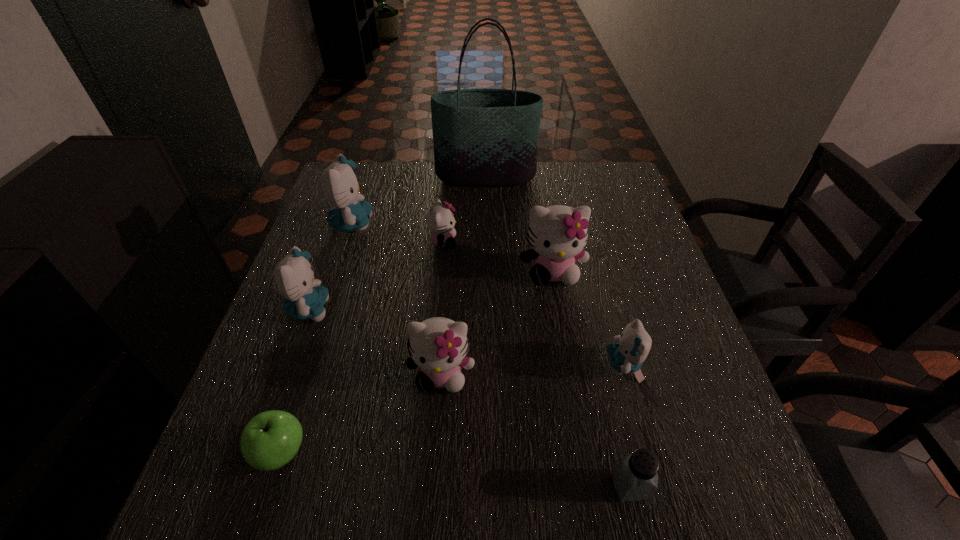
Locate an element on the screen. vacant space situated 0.290m on the face of the nearest blue kitten is located at coordinates (464, 364).

Find the location of a particular element. This screenshot has height=540, width=960. vacant space located 0.120m on the back of the apple is located at coordinates (308, 370).

The width and height of the screenshot is (960, 540). In order to click on vacant space located 0.340m on the back of the saltshaker in this screenshot , I will do `click(591, 316)`.

Where is `object at the far edge`? This screenshot has width=960, height=540. object at the far edge is located at coordinates (483, 137).

You are a GUI agent. You are given a task and a screenshot of the screen. Output one action in this format:
    pyautogui.click(x=<x>, y=<y>)
    Task: Click on the apple located at the near edge
    The height and width of the screenshot is (540, 960).
    Given the screenshot: What is the action you would take?
    pyautogui.click(x=271, y=439)

Find the location of a particular element. Image resolution: width=960 pixels, height=540 pixels. saltshaker located at the near edge is located at coordinates (635, 477).

Where is `apple located at the left edge`? The width and height of the screenshot is (960, 540). apple located at the left edge is located at coordinates (271, 439).

Where is `object that is positioned at the right edge`? object that is positioned at the right edge is located at coordinates (629, 351).

Where is `object at the near left corner`? object at the near left corner is located at coordinates (271, 439).

This screenshot has height=540, width=960. In the image, there is a desktop. Find the location of `vacant space at the far edge`. vacant space at the far edge is located at coordinates (532, 193).